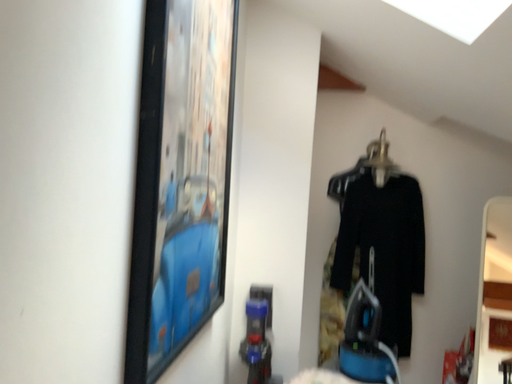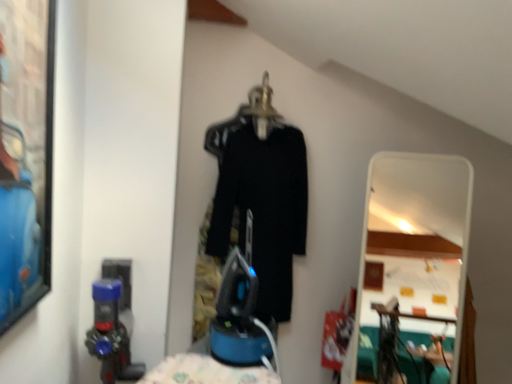
Question: Which way did the camera rotate in the video?

Choices:
 (A) rotated downward
 (B) rotated upward

Answer: (A)